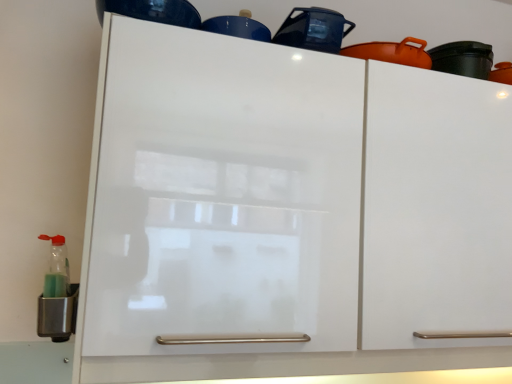
Question: Can you confirm if glossy ceramic pot at upper center, acting as the first appliance starting from the right, is smaller than glossy blue cup at upper center, the 2th appliance viewed from the right?

Choices:
 (A) no
 (B) yes

Answer: (A)

Question: Does glossy ceramic pot at upper center, the 3th appliance in the left-to-right sequence, come behind glossy blue cup at upper center, the second appliance from the left?

Choices:
 (A) yes
 (B) no

Answer: (B)

Question: From a real-world perspective, is glossy ceramic pot at upper center, acting as the first appliance starting from the right, located beneath glossy blue cup at upper center, the third appliance in the bottom-to-top sequence?

Choices:
 (A) no
 (B) yes

Answer: (A)

Question: Is glossy ceramic pot at upper center, which ranks as the second appliance in top-to-bottom order, at the right side of glossy blue cup at upper center, the third appliance in the bottom-to-top sequence?

Choices:
 (A) no
 (B) yes

Answer: (B)

Question: From the image's perspective, is glossy ceramic pot at upper center, which ranks as the second appliance in top-to-bottom order, above glossy blue cup at upper center, the third appliance in the bottom-to-top sequence?

Choices:
 (A) yes
 (B) no

Answer: (B)

Question: Does glossy ceramic pot at upper center, which ranks as the second appliance in top-to-bottom order, touch glossy blue cup at upper center, the third appliance in the bottom-to-top sequence?

Choices:
 (A) yes
 (B) no

Answer: (B)

Question: From a real-world perspective, does glossy blue cup at upper center, the 2th appliance viewed from the right, stand above metallic green bottle at lower left, placed as the 1th appliance when sorted from left to right?

Choices:
 (A) no
 (B) yes

Answer: (B)

Question: Is metallic green bottle at lower left, the 3th appliance in the right-to-left sequence, completely or partially inside glossy blue cup at upper center, acting as the first appliance starting from the top?

Choices:
 (A) yes
 (B) no

Answer: (B)

Question: Does glossy blue cup at upper center, acting as the first appliance starting from the top, have a lesser height compared to metallic green bottle at lower left, the 3th appliance in the right-to-left sequence?

Choices:
 (A) yes
 (B) no

Answer: (A)

Question: Is glossy blue cup at upper center, the second appliance from the left, positioned behind metallic green bottle at lower left, the 3th appliance in the right-to-left sequence?

Choices:
 (A) yes
 (B) no

Answer: (A)

Question: Considering the relative sizes of glossy blue cup at upper center, acting as the first appliance starting from the top, and metallic green bottle at lower left, placed as the 1th appliance when sorted from left to right, in the image provided, is glossy blue cup at upper center, acting as the first appliance starting from the top, wider than metallic green bottle at lower left, placed as the 1th appliance when sorted from left to right,?

Choices:
 (A) no
 (B) yes

Answer: (A)

Question: From a real-world perspective, does glossy blue cup at upper center, the second appliance from the left, sit lower than metallic green bottle at lower left, placed as the 1th appliance when sorted from left to right?

Choices:
 (A) no
 (B) yes

Answer: (A)

Question: Can you confirm if glossy blue cup at upper center, the 2th appliance viewed from the right, is shorter than glossy ceramic pot at upper center, acting as the first appliance starting from the right?

Choices:
 (A) yes
 (B) no

Answer: (A)